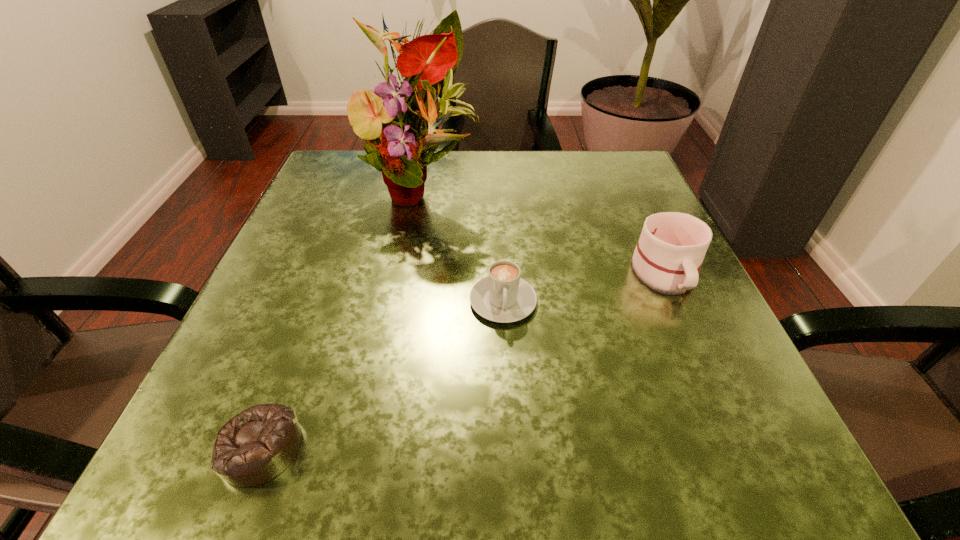
Locate an element on the screen. The width and height of the screenshot is (960, 540). free spot between the second shortest object and the mug is located at coordinates (584, 287).

At what (x,y) coordinates should I click in order to perform the action: click on unoccupied position between the third shortest object and the cappuccino. Please return your answer as a coordinate pair (x, y). The height and width of the screenshot is (540, 960). Looking at the image, I should click on (584, 287).

Where is `empty space that is in between the tallest object and the cappuccino`? The width and height of the screenshot is (960, 540). empty space that is in between the tallest object and the cappuccino is located at coordinates (462, 245).

Select which object is the third closest to the shortest object. Please provide its 2D coordinates. Your answer should be formatted as a tuple, i.e. [(x, y)], where the tuple contains the x and y coordinates of a point satisfying the conditions above.

[(668, 256)]

The height and width of the screenshot is (540, 960). I want to click on object that is the second closest to the cappuccino, so click(x=668, y=256).